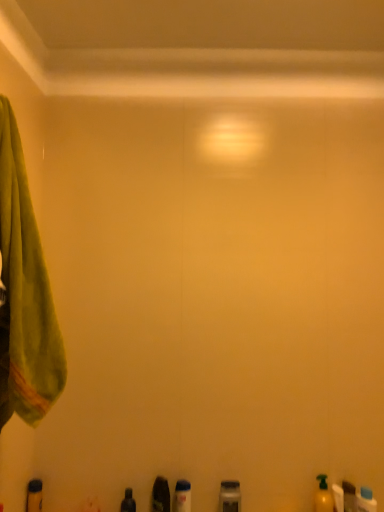
Question: Which direction should I rotate to look at translucent plastic bottle at lower center, which is the third toiletry from left to right?

Choices:
 (A) left
 (B) right

Answer: (A)

Question: Is metallic gray container at lower center, arranged as the fourth toiletry when viewed from the left, outside of yellow matte bottle at lower right, marked as the 6th toiletry in a left-to-right arrangement?

Choices:
 (A) yes
 (B) no

Answer: (A)

Question: Is metallic gray container at lower center, the 5th toiletry in the right-to-left sequence, next to yellow matte bottle at lower right, which appears as the 3th toiletry when viewed from the right?

Choices:
 (A) no
 (B) yes

Answer: (A)

Question: From a real-world perspective, is metallic gray container at lower center, the 5th toiletry in the right-to-left sequence, positioned under yellow matte bottle at lower right, which appears as the 3th toiletry when viewed from the right, based on gravity?

Choices:
 (A) yes
 (B) no

Answer: (B)

Question: Can you confirm if metallic gray container at lower center, arranged as the fourth toiletry when viewed from the left, is wider than yellow matte bottle at lower right, marked as the 6th toiletry in a left-to-right arrangement?

Choices:
 (A) no
 (B) yes

Answer: (B)

Question: Is the position of metallic gray container at lower center, arranged as the fourth toiletry when viewed from the left, less distant than that of yellow matte bottle at lower right, which appears as the 3th toiletry when viewed from the right?

Choices:
 (A) no
 (B) yes

Answer: (B)

Question: Considering the relative sizes of metallic gray container at lower center, the 5th toiletry in the right-to-left sequence, and yellow matte bottle at lower right, marked as the 6th toiletry in a left-to-right arrangement, in the image provided, is metallic gray container at lower center, the 5th toiletry in the right-to-left sequence, thinner than yellow matte bottle at lower right, marked as the 6th toiletry in a left-to-right arrangement,?

Choices:
 (A) yes
 (B) no

Answer: (B)

Question: Can you confirm if translucent plastic bottle at lower right, which is the second toiletry from right to left, is positioned to the right of yellow matte bottle at lower right, marked as the 6th toiletry in a left-to-right arrangement?

Choices:
 (A) no
 (B) yes

Answer: (B)

Question: Is translucent plastic bottle at lower right, arranged as the 7th toiletry when viewed from the left, behind yellow matte bottle at lower right, which appears as the 3th toiletry when viewed from the right?

Choices:
 (A) yes
 (B) no

Answer: (A)

Question: From a real-world perspective, is translucent plastic bottle at lower right, arranged as the 7th toiletry when viewed from the left, below yellow matte bottle at lower right, marked as the 6th toiletry in a left-to-right arrangement?

Choices:
 (A) yes
 (B) no

Answer: (A)

Question: Is translucent plastic bottle at lower right, which is the second toiletry from right to left, in front of yellow matte bottle at lower right, which appears as the 3th toiletry when viewed from the right?

Choices:
 (A) no
 (B) yes

Answer: (A)

Question: Can you confirm if translucent plastic bottle at lower right, arranged as the 7th toiletry when viewed from the left, is taller than yellow matte bottle at lower right, which appears as the 3th toiletry when viewed from the right?

Choices:
 (A) yes
 (B) no

Answer: (A)

Question: Considering the relative sizes of translucent plastic bottle at lower right, which is the second toiletry from right to left, and yellow matte bottle at lower right, marked as the 6th toiletry in a left-to-right arrangement, in the image provided, is translucent plastic bottle at lower right, which is the second toiletry from right to left, bigger than yellow matte bottle at lower right, marked as the 6th toiletry in a left-to-right arrangement,?

Choices:
 (A) yes
 (B) no

Answer: (A)

Question: Does translucent plastic bottle at lower center, which is the third toiletry from left to right, appear on the right side of yellow matte bottle at lower right, the fifth toiletry in the left-to-right sequence?

Choices:
 (A) yes
 (B) no

Answer: (B)